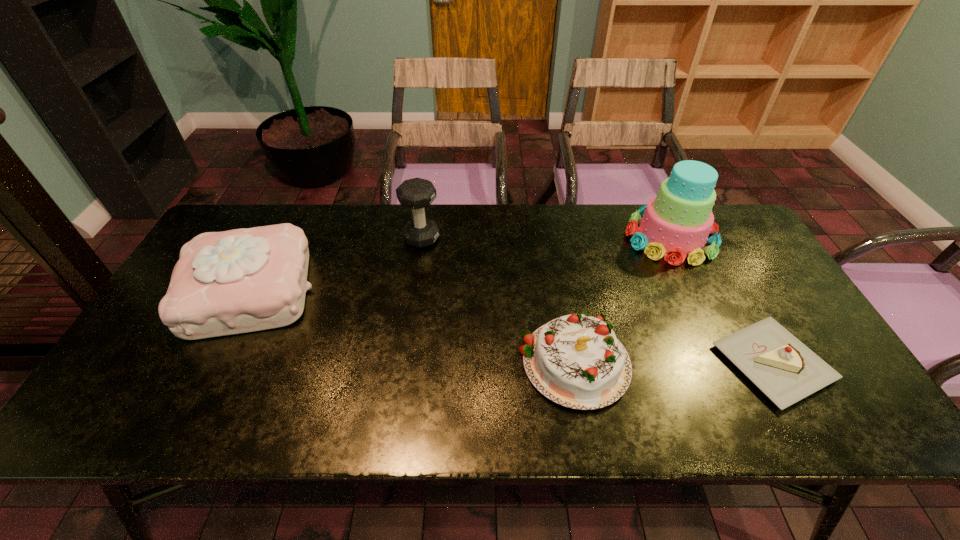
You are a GUI agent. You are given a task and a screenshot of the screen. Output one action in this format:
    pyautogui.click(x=<x>, y=<y>)
    Task: Click on the vacant region located on the left of the shortest cake
    The width and height of the screenshot is (960, 540).
    Given the screenshot: What is the action you would take?
    pyautogui.click(x=623, y=363)

The height and width of the screenshot is (540, 960). In order to click on dumbbell at the far edge in this screenshot , I will do `click(417, 193)`.

Identify the location of object positioned at the left edge. (243, 280).

You are a GUI agent. You are given a task and a screenshot of the screen. Output one action in this format:
    pyautogui.click(x=<x>, y=<y>)
    Task: Click on the object present at the far left corner
    This screenshot has height=540, width=960.
    Given the screenshot: What is the action you would take?
    pyautogui.click(x=243, y=280)

You are a GUI agent. You are given a task and a screenshot of the screen. Output one action in this format:
    pyautogui.click(x=<x>, y=<y>)
    Task: Click on the object positioned at the far right corner
    The height and width of the screenshot is (540, 960).
    Given the screenshot: What is the action you would take?
    pyautogui.click(x=676, y=223)

Locate an element on the screen. object positioned at the near right corner is located at coordinates (781, 366).

In the image, there is a desktop. Identify the location of vacant space at the far edge. (602, 234).

The image size is (960, 540). In order to click on vacant space at the near edge in this screenshot , I will do `click(351, 416)`.

Locate an element on the screen. The width and height of the screenshot is (960, 540). vacant region at the left edge of the desktop is located at coordinates (178, 351).

Where is `free space at the right edge of the desktop`? free space at the right edge of the desktop is located at coordinates (834, 369).